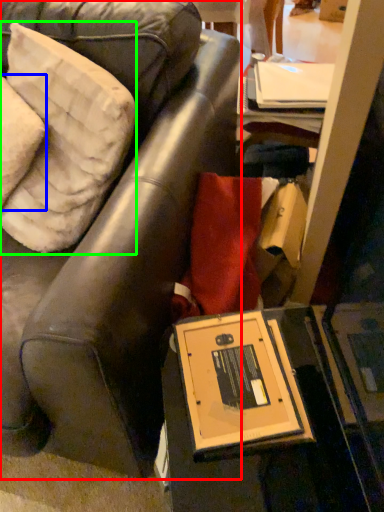
Question: Estimate the real-world distances between objects in this image. Which object is farther from chair (highlighted by a red box), pillow (highlighted by a blue box) or pillow (highlighted by a green box)?

Choices:
 (A) pillow
 (B) pillow

Answer: (A)